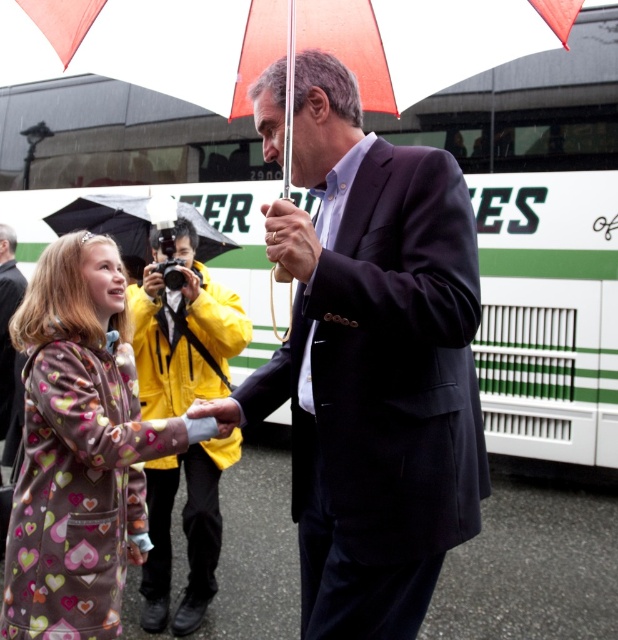
Is point (15, 445) closer to viewer compared to point (286, 221)?

No, it is behind (286, 221).

Does dark suit at center appear over matte black umbrella at center?

Actually, dark suit at center is below matte black umbrella at center.

You are a GUI agent. You are given a task and a screenshot of the screen. Output one action in this format:
    pyautogui.click(x=<x>, y=<y>)
    Task: Click on the dark suit at center
    The width and height of the screenshot is (618, 640).
    Given the screenshot: What is the action you would take?
    pyautogui.click(x=7, y=330)

Locate an element on the screen. Image resolution: width=618 pixels, height=640 pixels. dark suit at center is located at coordinates (7, 330).

Between matte black suit at center and orange fabric umbrella at upper center, which one has less height?

orange fabric umbrella at upper center

Which is above, matte black suit at center or orange fabric umbrella at upper center?

orange fabric umbrella at upper center

This screenshot has width=618, height=640. What do you see at coordinates (376, 369) in the screenshot?
I see `matte black suit at center` at bounding box center [376, 369].

Locate an element on the screen. This screenshot has height=640, width=618. matte black suit at center is located at coordinates (376, 369).

Is white/green striped bus at center bigger than matte black umbrella at center?

Yes.

Describe the element at coordinates (540, 237) in the screenshot. The height and width of the screenshot is (640, 618). I see `white/green striped bus at center` at that location.

Between point (564, 266) and point (284, 212), which one is positioned behind?

Positioned behind is point (564, 266).

Image resolution: width=618 pixels, height=640 pixels. Find the location of `white/green striped bus at center`. white/green striped bus at center is located at coordinates (540, 237).